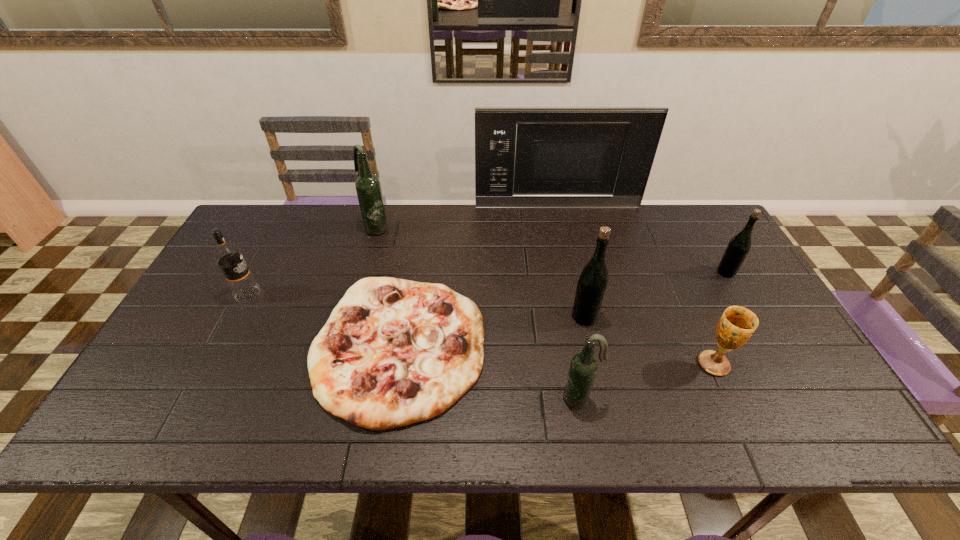
The image size is (960, 540). I want to click on the smaller dark beer bottle, so click(583, 367).

The width and height of the screenshot is (960, 540). Find the location of `the second shortest object`. the second shortest object is located at coordinates (737, 324).

Locate an element on the screen. the shortest object is located at coordinates (394, 352).

Identify the location of free region located on the front panel of the dark microwave oven. This screenshot has height=540, width=960. (564, 235).

You are a GUI agent. You are given a task and a screenshot of the screen. Output one action in this format:
    pyautogui.click(x=<x>, y=<y>)
    Task: Click on the vacant space located 0.190m on the left of the left dark beer bottle
    Image resolution: width=960 pixels, height=540 pixels.
    Given the screenshot: What is the action you would take?
    pyautogui.click(x=306, y=228)

Identify the location of vacant space located 0.370m on the left of the nearer green beer bottle. The height and width of the screenshot is (540, 960). (434, 317).

The height and width of the screenshot is (540, 960). I want to click on vacant area situated 0.320m on the label of the vodka, so click(x=373, y=295).

The image size is (960, 540). Identify the location of free region located on the back of the right green beer bottle. (705, 235).

I want to click on vacant space located on the right of the nearer dark beer bottle, so point(702,399).

Identify the location of free spot located 0.360m on the back of the second shortest object. (x=665, y=257).